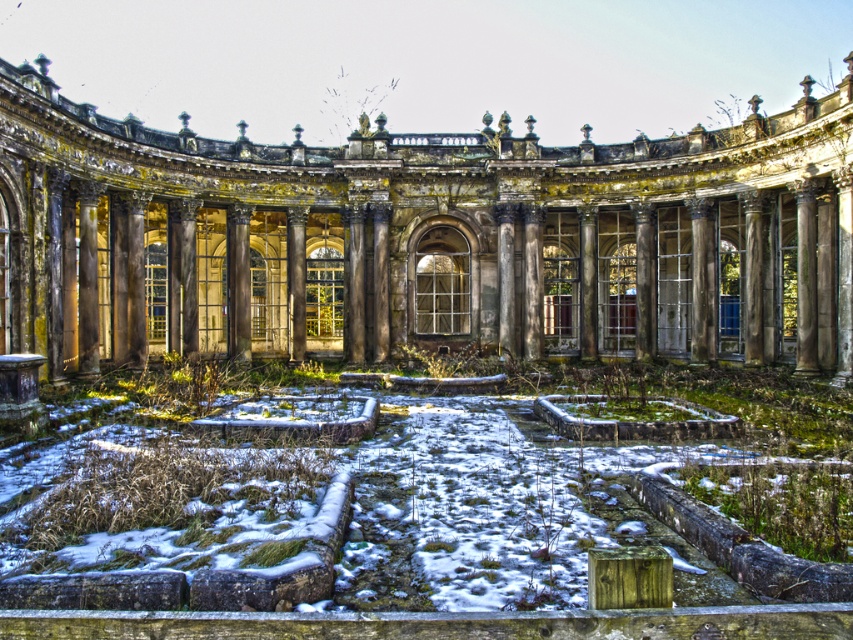
Question: Can you confirm if weathered stone palace at center is thinner than white powdery snow at center?

Choices:
 (A) yes
 (B) no

Answer: (B)

Question: Is weathered stone palace at center positioned at the back of white powdery snow at center?

Choices:
 (A) no
 (B) yes

Answer: (B)

Question: Which point appears closest to the camera in this image?

Choices:
 (A) (154, 144)
 (B) (381, 468)

Answer: (B)

Question: Which point is closer to the camera taking this photo?

Choices:
 (A) (461, 540)
 (B) (270, 65)

Answer: (A)

Question: Does weathered stone palace at center appear under white powdery snow at center?

Choices:
 (A) no
 (B) yes

Answer: (A)